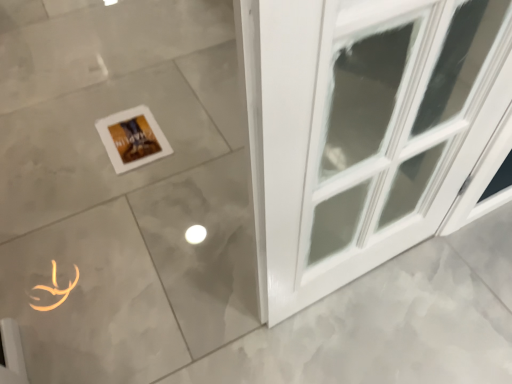
Question: From the image's perspective, is white matte picture frame at center above matte gray tile at center?

Choices:
 (A) yes
 (B) no

Answer: (B)

Question: From the image's perspective, is white matte picture frame at center under matte gray tile at center?

Choices:
 (A) no
 (B) yes

Answer: (B)

Question: Is white matte picture frame at center outside of matte gray tile at center?

Choices:
 (A) yes
 (B) no

Answer: (B)

Question: From a real-world perspective, is white matte picture frame at center over matte gray tile at center?

Choices:
 (A) no
 (B) yes

Answer: (B)

Question: Considering the relative positions of white matte picture frame at center and matte gray tile at center in the image provided, is white matte picture frame at center to the right of matte gray tile at center from the viewer's perspective?

Choices:
 (A) yes
 (B) no

Answer: (B)

Question: Is white matte picture frame at center positioned before matte gray tile at center?

Choices:
 (A) no
 (B) yes

Answer: (A)

Question: Does matte gray tile at center have a greater width compared to white matte picture frame at center?

Choices:
 (A) yes
 (B) no

Answer: (A)

Question: Is the surface of matte gray tile at center in direct contact with white matte picture frame at center?

Choices:
 (A) no
 (B) yes

Answer: (A)

Question: Can you confirm if matte gray tile at center is bigger than white matte picture frame at center?

Choices:
 (A) yes
 (B) no

Answer: (A)

Question: Is the depth of matte gray tile at center less than that of white matte picture frame at center?

Choices:
 (A) yes
 (B) no

Answer: (A)

Question: Is matte gray tile at center further to the viewer compared to white matte picture frame at center?

Choices:
 (A) no
 (B) yes

Answer: (A)

Question: Considering the relative positions of matte gray tile at center and white matte picture frame at center in the image provided, is matte gray tile at center to the right of white matte picture frame at center from the viewer's perspective?

Choices:
 (A) no
 (B) yes

Answer: (B)

Question: Is matte gray tile at center wider or thinner than white matte picture frame at center?

Choices:
 (A) thin
 (B) wide

Answer: (B)